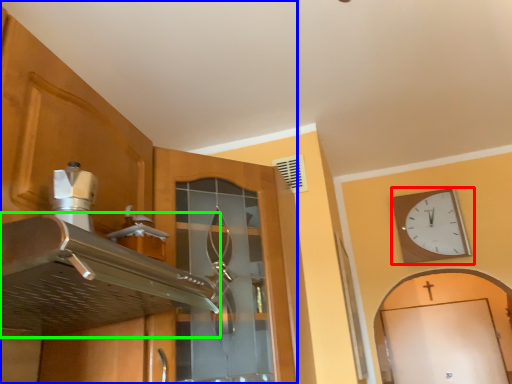
Question: Based on their relative distances, which object is farther from wall clock (highlighted by a red box)? Choose from cabinetry (highlighted by a blue box) and exhaust hood (highlighted by a green box).

Choices:
 (A) cabinetry
 (B) exhaust hood

Answer: (B)